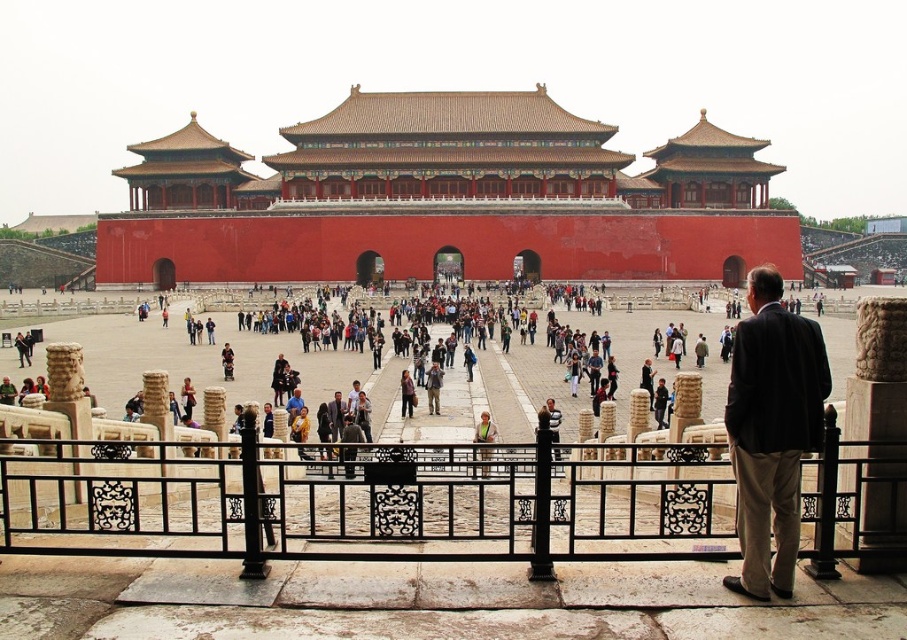
Does point (768, 324) lie in front of point (347, 419)?

That is True.

Based on the photo, does dark brown suit at center have a lesser height compared to dark brown leather jacket at center?

No.

Measure the distance between dark brown suit at center and camera.

dark brown suit at center is 29.73 meters from camera.

You are a GUI agent. You are given a task and a screenshot of the screen. Output one action in this format:
    pyautogui.click(x=<x>, y=<y>)
    Task: Click on the dark brown suit at center
    
    Given the screenshot: What is the action you would take?
    pyautogui.click(x=771, y=429)

Can you confirm if dark brown suit at center is positioned above dark gray suit at center?

Yes.

Can you confirm if dark brown suit at center is positioned to the left of dark gray suit at center?

In fact, dark brown suit at center is to the right of dark gray suit at center.

Locate an element on the screen. dark brown suit at center is located at coordinates (771, 429).

Does black wrought iron fence at center have a larger size compared to dark gray suit at center?

Yes, black wrought iron fence at center is bigger than dark gray suit at center.

Consider the image. Can you confirm if black wrought iron fence at center is wider than dark gray suit at center?

Yes, black wrought iron fence at center is wider than dark gray suit at center.

Who is more forward, (342, 540) or (329, 428)?

Point (342, 540)

Find the location of a particular element. black wrought iron fence at center is located at coordinates coord(367,499).